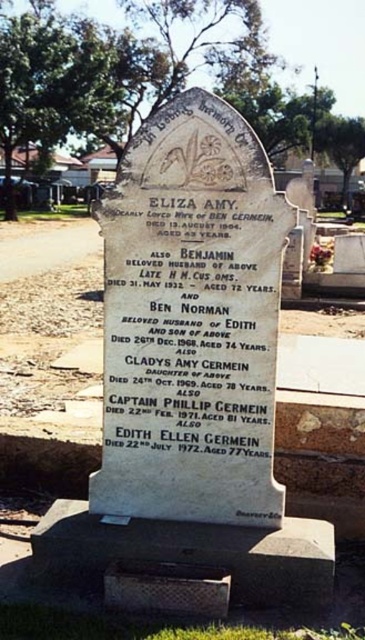
Is white stone monument at center positioned before white stone plaque at center?

That is True.

Between white stone monument at center and white stone plaque at center, which one has less height?

white stone plaque at center is shorter.

Locate an element on the screen. white stone monument at center is located at coordinates (191, 369).

Find the location of a particular element. white stone monument at center is located at coordinates click(191, 369).